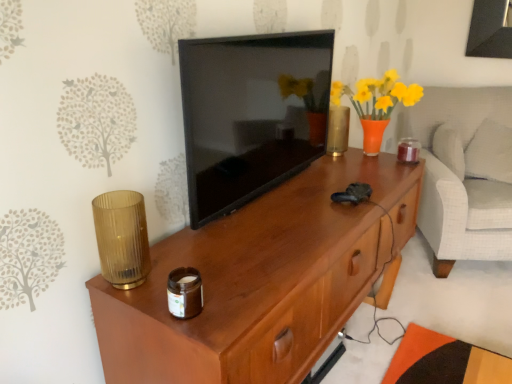
Where is `free location in front of translucent amber glass candle at right, acting as the third candle holder starting from the front`? free location in front of translucent amber glass candle at right, acting as the third candle holder starting from the front is located at coordinates (399, 168).